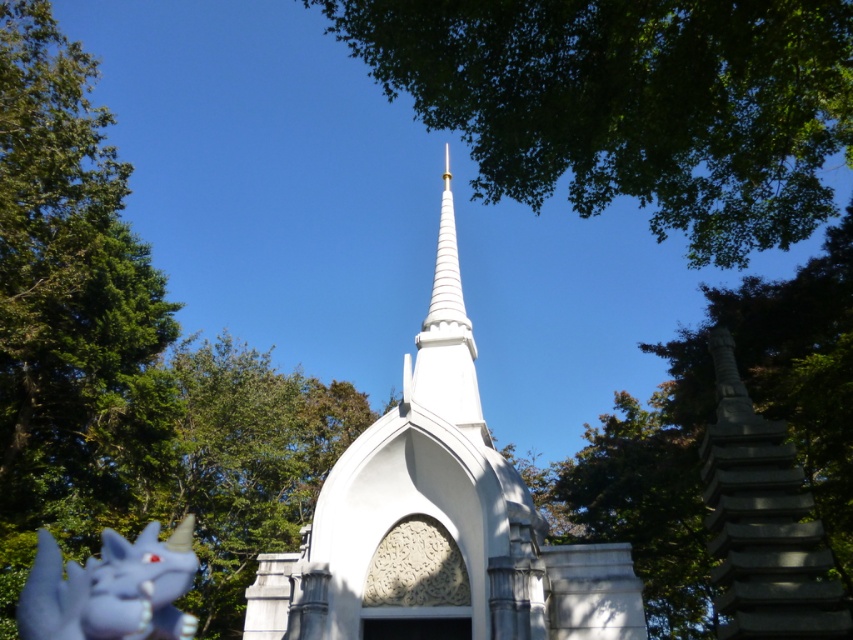
Question: Among these objects, which one is nearest to the camera?

Choices:
 (A) matte purple dragon at lower left
 (B) green leafy tree at upper center

Answer: (B)

Question: Can you confirm if white stone church at center is positioned above matte purple dragon at lower left?

Choices:
 (A) yes
 (B) no

Answer: (A)

Question: Which point appears farthest from the camera in this image?

Choices:
 (A) (90, 611)
 (B) (451, 321)

Answer: (B)

Question: Does green leafy tree at upper center have a lesser width compared to matte purple dragon at lower left?

Choices:
 (A) yes
 (B) no

Answer: (B)

Question: Which of the following is the farthest from the observer?

Choices:
 (A) white stone church at center
 (B) matte purple dragon at lower left

Answer: (A)

Question: Does green leafy tree at upper center have a smaller size compared to white stone church at center?

Choices:
 (A) no
 (B) yes

Answer: (A)